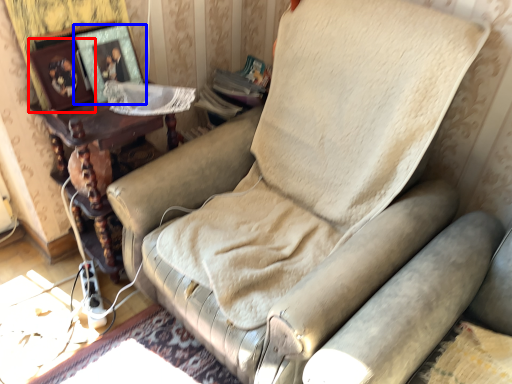
Question: Among these objects, which one is nearest to the camera, picture frame (highlighted by a red box) or picture frame (highlighted by a blue box)?

Choices:
 (A) picture frame
 (B) picture frame

Answer: (A)